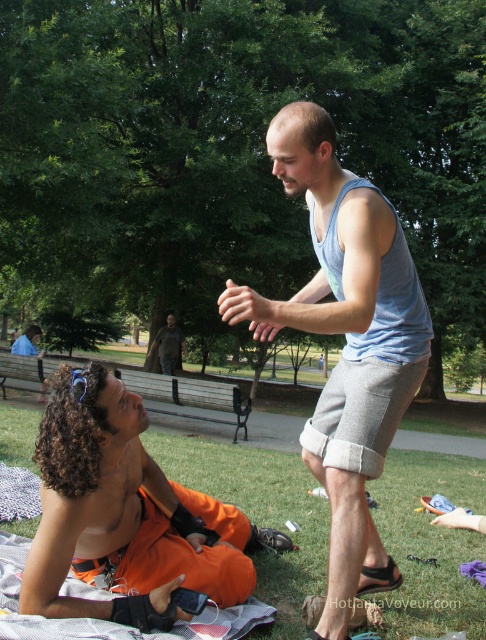
Is light blue tank top at center further to the viewer compared to orange fabric pants at lower left?

No.

Can you confirm if light blue tank top at center is wider than orange fabric pants at lower left?

Incorrect, light blue tank top at center's width does not surpass orange fabric pants at lower left's.

Locate an element on the screen. light blue tank top at center is located at coordinates (346, 342).

Based on the photo, does light blue tank top at center come behind camouflage fabric jacket at center?

No.

Does light blue tank top at center appear over camouflage fabric jacket at center?

Yes.

Is point (397, 275) positioned before point (167, 371)?

Yes.

Locate an element on the screen. This screenshot has height=640, width=486. light blue tank top at center is located at coordinates (346, 342).

Who is positioned more to the right, orange fabric pants at lower left or camouflage fabric jacket at center?

orange fabric pants at lower left is more to the right.

What do you see at coordinates (125, 515) in the screenshot? I see `orange fabric pants at lower left` at bounding box center [125, 515].

Who is more distant from viewer, (107, 513) or (156, 348)?

Positioned behind is point (156, 348).

Where is `orange fabric pants at lower left`? orange fabric pants at lower left is located at coordinates (125, 515).